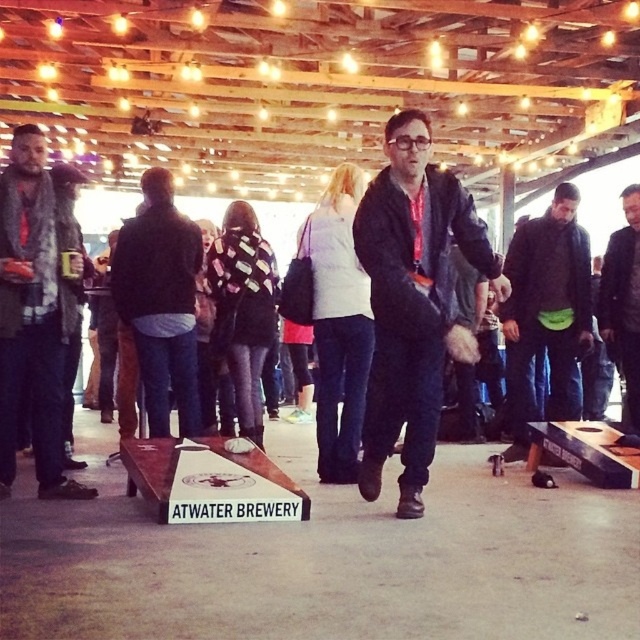
You are standing at the starting line of the cornhole game. You want to throw your beanbag towards the cornhole board. There are two points marked on the ground where previous beanbags landed. The first point is at coordinates point (x=22, y=164) and the second point is at coordinates point (x=168, y=257). Which point is closer to you, the player, as you stand at the starting line?

Point (x=22, y=164) is closer to you because it is in front of point (x=168, y=257), meaning it is nearer to your position at the starting line.

In the scene shown: You are at the event and need to locate the black matte jacket at center. According to the coordinates provided, where should you look?

The black matte jacket at center is located at point coordinates 0.472 on the x axis and 0.252 on the y axis.

You are a photographer at the event and want to capture both the black matte jacket at center and the green fabric pouch at center in a single frame. Which object should you focus on first to ensure both are in the frame?

The black matte jacket at center is shorter than the green fabric pouch at center. Focus on the black matte jacket at center first since it is closer to the camera, ensuring both objects are within the frame.